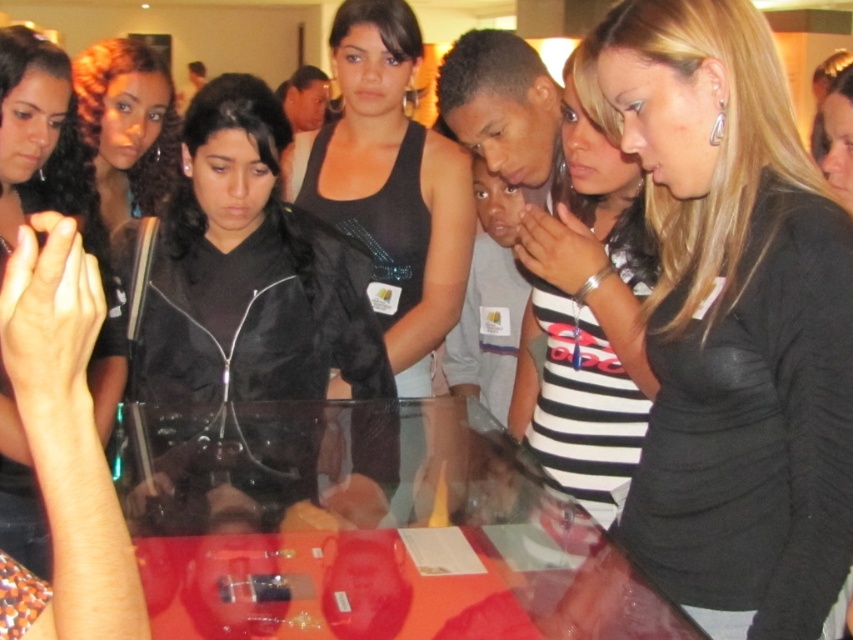
Question: Among these points, which one is nearest to the camera?

Choices:
 (A) (379, 193)
 (B) (706, 317)

Answer: (B)

Question: Which object is positioned closest to the black matte shirt at center?

Choices:
 (A) curly hair at center
 (B) black leather jacket at center

Answer: (B)

Question: Is black leather jacket at center positioned in front of matte black jacket at upper left?

Choices:
 (A) yes
 (B) no

Answer: (B)

Question: Is black leather jacket at center below matte black jacket at upper left?

Choices:
 (A) yes
 (B) no

Answer: (B)

Question: Which object is the closest to the black sequined tank top at center?

Choices:
 (A) black leather jacket at center
 (B) curly hair at center
 (C) striped jersey at center
 (D) black matte shirt at center

Answer: (A)

Question: Can you confirm if black sequined tank top at center is thinner than matte black jacket at upper left?

Choices:
 (A) yes
 (B) no

Answer: (B)